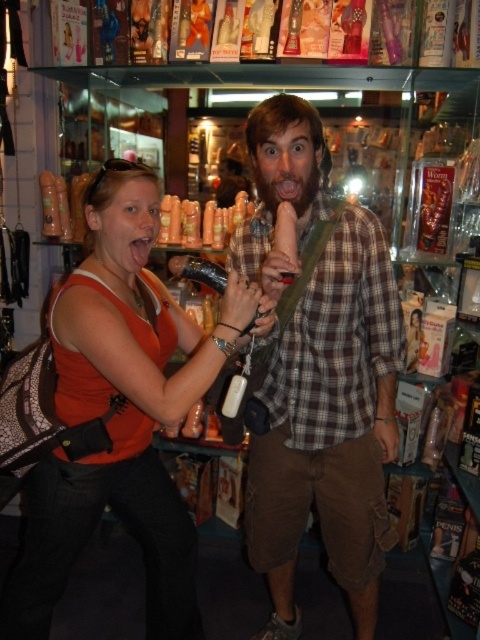
You are a store employee who needs to place a new shelf that is 1.2 meters tall between the orange matte tank top at center and the brown fuzzy beard at center. Can the shelf fit vertically between them based on their heights?

The orange matte tank top at center is much taller than the brown fuzzy beard at center. Since the shelf is 1.2 meters tall, it can fit vertically between them as the height difference allows space for the shelf.